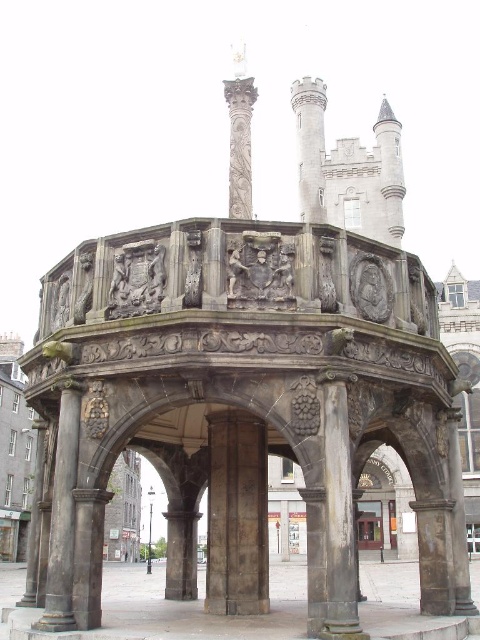
Based on the photo, is dark gray stone column at center shorter than glass door at center?

Yes, dark gray stone column at center is shorter than glass door at center.

How far apart are dark gray stone column at center and glass door at center?

dark gray stone column at center and glass door at center are 75.42 meters apart.

You are a GUI agent. You are given a task and a screenshot of the screen. Output one action in this format:
    pyautogui.click(x=<x>, y=<y>)
    Task: Click on the dark gray stone column at center
    
    Given the screenshot: What is the action you would take?
    pyautogui.click(x=237, y=515)

This screenshot has height=640, width=480. What are the coordinates of `dark gray stone column at center` in the screenshot? It's located at (237, 515).

Is dark gray stone column at center shorter than bronze stone column at center?

Yes, dark gray stone column at center is shorter than bronze stone column at center.

Does point (217, 468) lie in front of point (71, 602)?

No, it is not.

Between point (224, 609) and point (47, 611), which one is positioned behind?

The point (224, 609) is more distant.

In order to click on dark gray stone column at center in this screenshot , I will do `click(237, 515)`.

Does bronze stone column at center have a greater width compared to glass door at center?

Incorrect, bronze stone column at center's width does not surpass glass door at center's.

Is bronze stone column at center positioned behind glass door at center?

No, bronze stone column at center is closer to the viewer.

Who is more distant from viewer, [63,518] or [360,509]?

Point [360,509]

Identify the location of bronze stone column at center. (62, 516).